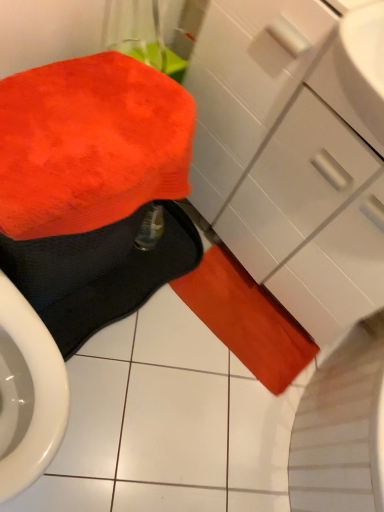
The width and height of the screenshot is (384, 512). Identify the location of free point above orange suede bath towel at lower center, which is the 3th bath towel from front to back (from a real-world perspective). (267, 312).